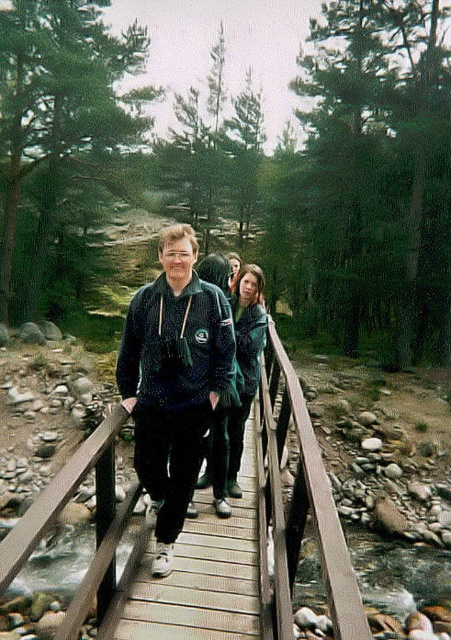
You are a photographer standing at the edge of the wooden bridge. You want to take a photo of the dark blue fleece at center. Where should you position yourself to ensure the fleece is in the center of your camera frame?

Position yourself directly in front of the dark blue fleece at center located at point (174, 380) to ensure it is centered in your camera frame.

You are standing on the wooden bridge and want to take a photo of the dark blue fleece at center and the wooden at center. Which object should you position to the right side in your camera frame?

You should position the wooden at center to the right side in your camera frame because the wooden at center is to the right of the dark blue fleece at center.